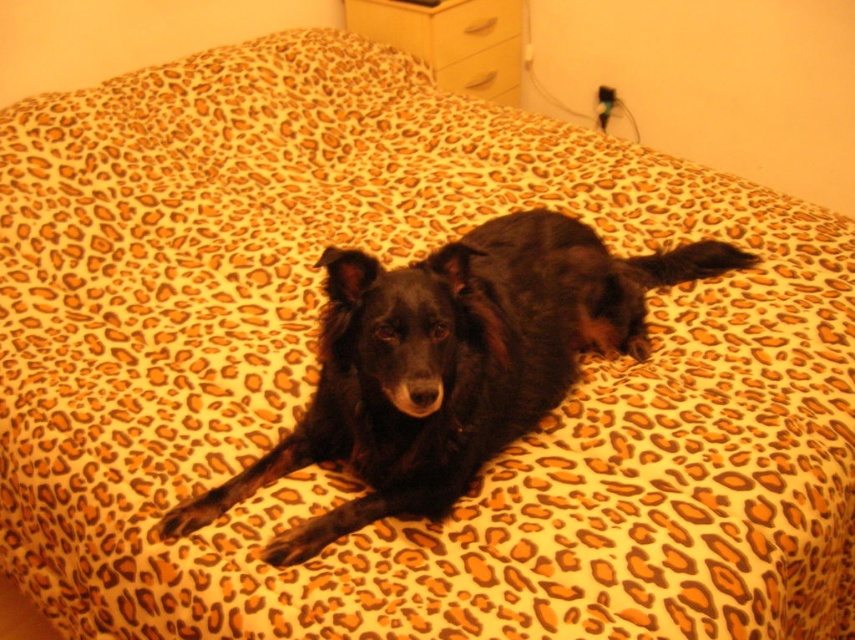
Can you confirm if white glossy dresser at upper center is positioned to the left of matte white drawer at upper center?

Yes, white glossy dresser at upper center is to the left of matte white drawer at upper center.

Is white glossy dresser at upper center closer to camera compared to matte white drawer at upper center?

Yes, it is.

Is point (453, 29) closer to viewer compared to point (476, 8)?

That is True.

Locate an element on the screen. Image resolution: width=855 pixels, height=640 pixels. white glossy dresser at upper center is located at coordinates (451, 40).

Does black fur dog at center have a lesser width compared to matte yellow drawer at upper center?

Incorrect, black fur dog at center's width is not less than matte yellow drawer at upper center's.

Does black fur dog at center appear over matte yellow drawer at upper center?

Actually, black fur dog at center is below matte yellow drawer at upper center.

Find the location of `black fur dog at center`. black fur dog at center is located at coordinates (451, 362).

Who is more distant from viewer, (x=525, y=259) or (x=494, y=3)?

Point (x=494, y=3)

Find the location of a particular element. black fur dog at center is located at coordinates (451, 362).

Find the location of a particular element. The width and height of the screenshot is (855, 640). black fur dog at center is located at coordinates (451, 362).